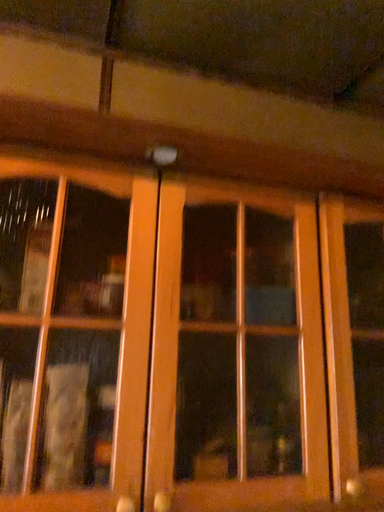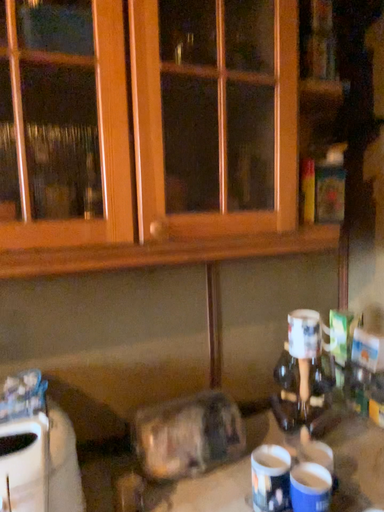
Question: Which way did the camera rotate in the video?

Choices:
 (A) rotated downward
 (B) rotated upward

Answer: (A)